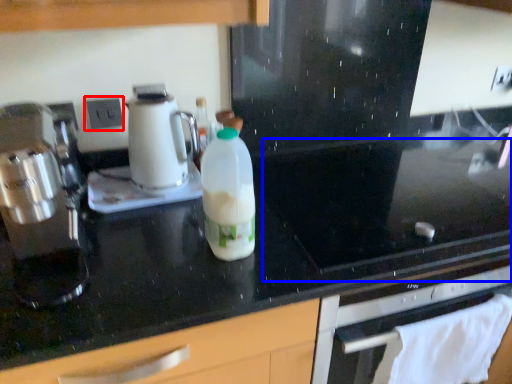
Question: Which object appears closest to the camera in this image, electric outlet (highlighted by a red box) or gas stove (highlighted by a blue box)?

Choices:
 (A) electric outlet
 (B) gas stove

Answer: (B)